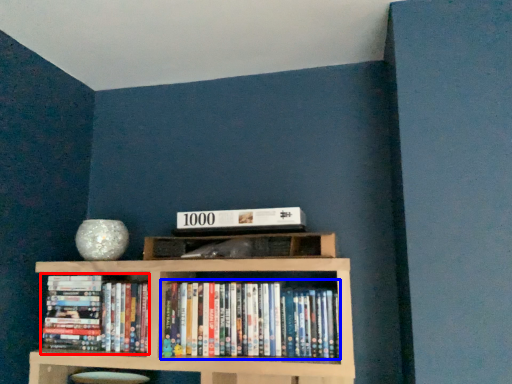
Question: Which of the following is the closest to the observer, book (highlighted by a red box) or book (highlighted by a blue box)?

Choices:
 (A) book
 (B) book

Answer: (B)